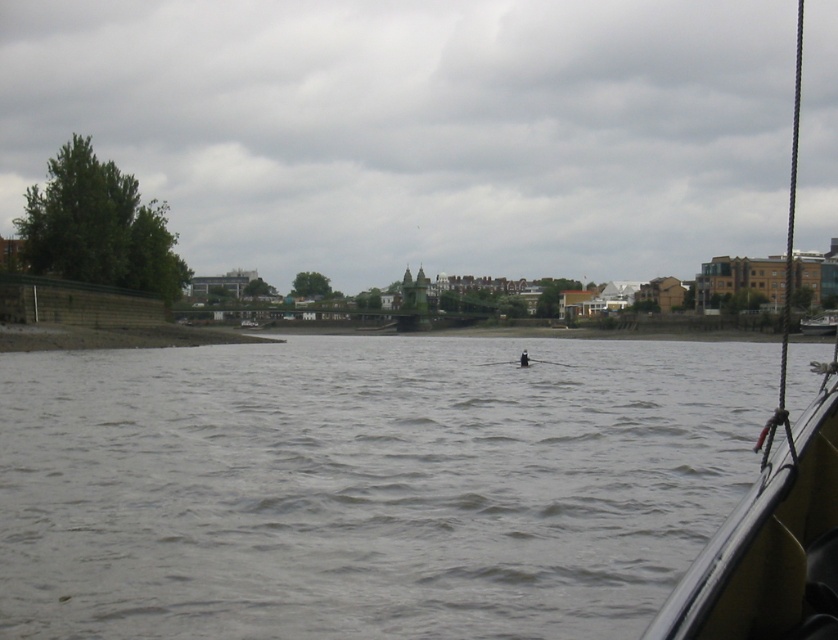
You are standing at the point with coordinates (x=773, y=513). What object is located at your current position?

The black rubber boat at right is located at point (x=773, y=513).